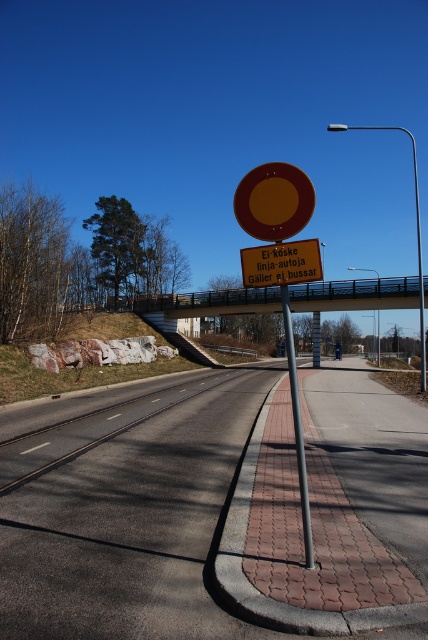
Question: In this image, where is asphalt road at center located relative to yellow circular sign at center?

Choices:
 (A) right
 (B) left

Answer: (A)

Question: Which of the following is the farthest from the observer?

Choices:
 (A) polished metal pole at center
 (B) yellow reflective circle at center
 (C) asphalt road at center
 (D) metallic gray bridge at center

Answer: (B)

Question: Can you confirm if metallic gray bridge at center is positioned to the right of yellow circular sign at center?

Choices:
 (A) no
 (B) yes

Answer: (B)

Question: Estimate the real-world distances between objects in this image. Which object is farther from the yellow reflective circle at center?

Choices:
 (A) asphalt road at center
 (B) yellow circular sign at center
 (C) polished metal pole at center
 (D) metallic gray bridge at center

Answer: (C)

Question: Which point appears closest to the camera in this image?

Choices:
 (A) (297, 182)
 (B) (293, 342)
 (C) (112, 616)

Answer: (C)

Question: Can you confirm if metallic gray bridge at center is positioned to the right of yellow circular sign at center?

Choices:
 (A) yes
 (B) no

Answer: (A)